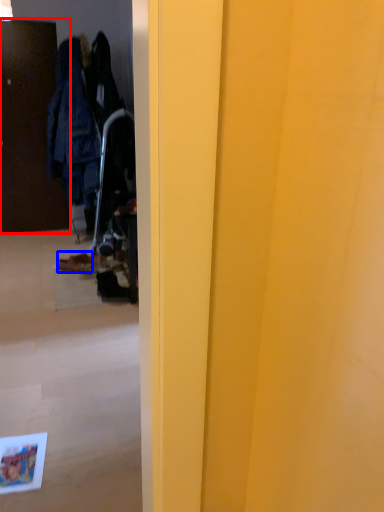
Question: Which object is further to the camera taking this photo, door (highlighted by a red box) or footwear (highlighted by a blue box)?

Choices:
 (A) door
 (B) footwear

Answer: (A)